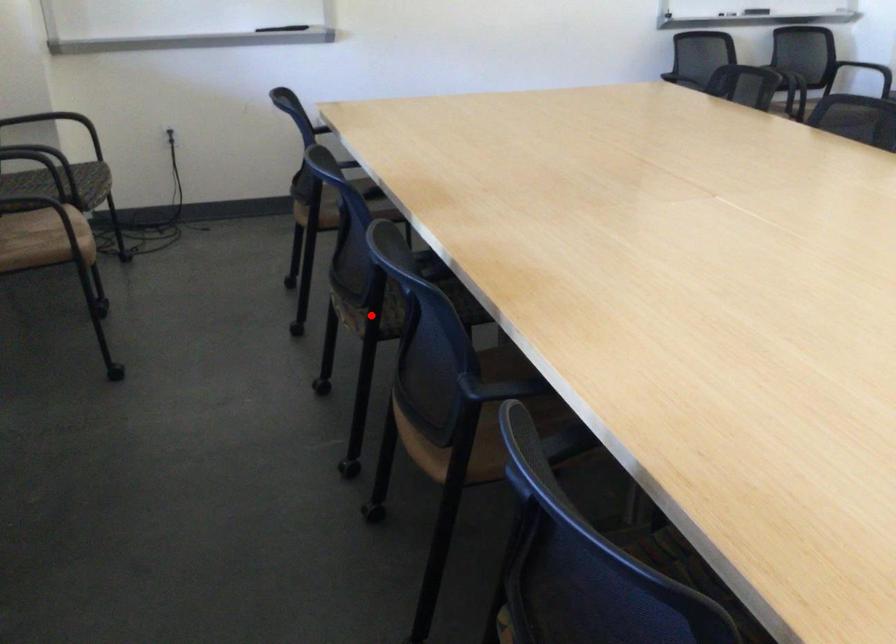
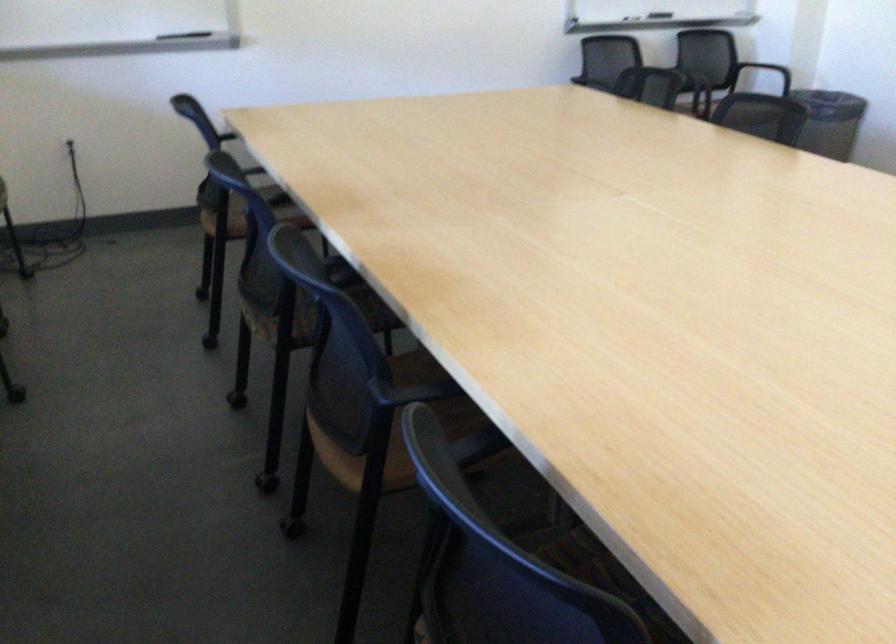
Where in the second image is the point corresponding to the highlighted location from the first image?

(280, 323)